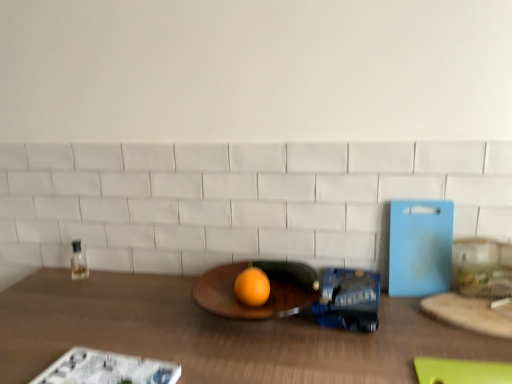
At what (x,y) coordinates should I click in order to perform the action: click on empty space that is ontop of wooden table at center (from a real-world perspective). Please return your answer as a coordinate pair (x, y). Looking at the image, I should click on (177, 328).